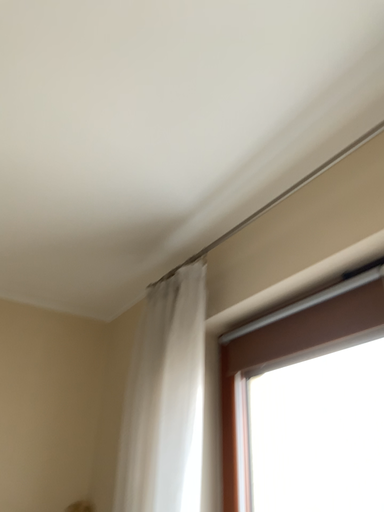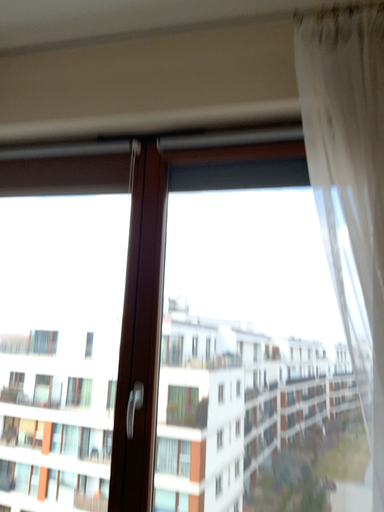
Question: How did the camera likely rotate when shooting the video?

Choices:
 (A) rotated downward
 (B) rotated upward

Answer: (A)